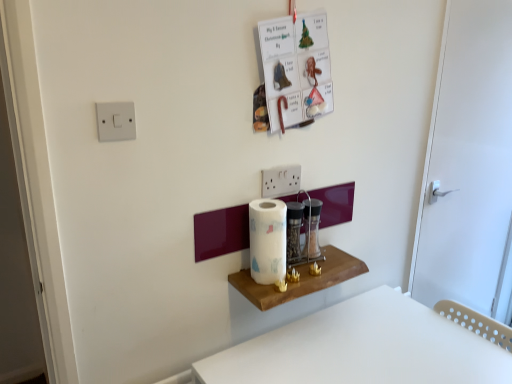
At what (x,y) coordinates should I click in order to perform the action: click on white glossy paper towel at center. Please return your answer as a coordinate pair (x, y). The height and width of the screenshot is (384, 512). Looking at the image, I should click on (267, 240).

In order to click on wooden shelf at center in this screenshot , I will do `click(300, 279)`.

This screenshot has width=512, height=384. In order to click on white glossy paper towel at center in this screenshot , I will do `click(267, 240)`.

Is white plastic table at lower right located outside white plastic light switch at upper left?

Indeed, white plastic table at lower right is completely outside white plastic light switch at upper left.

From the image's perspective, is white plastic table at lower right above or below white plastic light switch at upper left?

Clearly, from the image's perspective, white plastic table at lower right is below white plastic light switch at upper left.

Where is `light switch behind the white plastic table at lower right`? This screenshot has height=384, width=512. light switch behind the white plastic table at lower right is located at coordinates (116, 121).

From the picture: Considering the sizes of objects white plastic table at lower right and white plastic light switch at upper left in the image provided, who is smaller, white plastic table at lower right or white plastic light switch at upper left?

Smaller between the two is white plastic light switch at upper left.

Does white plastic table at lower right appear on the left side of white matte door at right?

Yes.

Is white plastic table at lower right not within white matte door at right?

white plastic table at lower right is positioned outside white matte door at right.

Is white matte door at right at the back of white plastic table at lower right?

No, white matte door at right is not at the back of white plastic table at lower right.

How different are the orientations of white matte door at right and white glossy paper towel at center in degrees?

They differ by 0.00121 degrees in their facing directions.

From a real-world perspective, is white matte door at right located beneath white glossy paper towel at center?

Incorrect, from a real-world perspective, white matte door at right is higher than white glossy paper towel at center.

Is white matte door at right closer to camera compared to white glossy paper towel at center?

No, white matte door at right is further to the viewer.

Does white matte door at right appear on the right side of white glossy paper towel at center?

Indeed, white matte door at right is positioned on the right side of white glossy paper towel at center.

Looking at this image, from a real-world perspective, between wooden shelf at center and white glossy paper towel at center, who is vertically lower?

wooden shelf at center, from a real-world perspective.

Locate an element on the screen. shelf located behind the white glossy paper towel at center is located at coordinates (300, 279).

Is wooden shelf at center positioned with its back to white glossy paper towel at center?

No, white glossy paper towel at center is not at the back of wooden shelf at center.

Is wooden shelf at center shorter than white glossy paper towel at center?

Indeed, wooden shelf at center has a lesser height compared to white glossy paper towel at center.

Considering the sizes of objects wooden shelf at center and white matte door at right in the image provided, who is smaller, wooden shelf at center or white matte door at right?

wooden shelf at center.

Which is closer, (326, 262) or (488, 240)?

Point (326, 262) is positioned closer to the camera compared to point (488, 240).

Is wooden shelf at center facing towards white matte door at right?

No, wooden shelf at center does not turn towards white matte door at right.

Is wooden shelf at center located outside white matte door at right?

Yes.

Could wooden shelf at center be considered to be inside white glossy paper towel at center?

No, wooden shelf at center is not inside white glossy paper towel at center.

Based on the photo, is white glossy paper towel at center facing towards wooden shelf at center?

No, white glossy paper towel at center is not facing towards wooden shelf at center.

From a real-world perspective, is white glossy paper towel at center physically below wooden shelf at center?

Incorrect, from a real-world perspective, white glossy paper towel at center is higher than wooden shelf at center.

Which object is wider, wooden shelf at center or white plastic light switch at upper left?

With larger width is wooden shelf at center.

Is wooden shelf at center at the left side of white plastic light switch at upper left?

Incorrect, wooden shelf at center is not on the left side of white plastic light switch at upper left.

Find the location of a particular element. light switch that appears in front of the wooden shelf at center is located at coordinates (116, 121).

Is wooden shelf at center in front of white plastic light switch at upper left?

No.

The width and height of the screenshot is (512, 384). I want to click on furniture below the white plastic light switch at upper left (from a real-world perspective), so click(362, 348).

Find the location of a particular element. The image size is (512, 384). furniture below the white matte door at right (from the image's perspective) is located at coordinates (362, 348).

Considering their positions, is white matte door at right positioned further to white glossy paper towel at center than white plastic light switch at upper left?

white matte door at right is positioned further to the anchor white glossy paper towel at center.

Looking at the image, which one is located closer to white matte door at right, wooden shelf at center or white glossy paper towel at center?

wooden shelf at center lies closer to white matte door at right than the other object.

Which object lies further to the anchor point white plastic table at lower right, white matte door at right or wooden shelf at center?

white matte door at right.

Considering their positions, is white plastic light switch at upper left positioned closer to white matte door at right than wooden shelf at center?

Based on the image, wooden shelf at center appears to be nearer to white matte door at right.

Estimate the real-world distances between objects in this image. Which object is further from white matte door at right, white glossy paper towel at center or white plastic light switch at upper left?

The object further to white matte door at right is white plastic light switch at upper left.

Considering their positions, is white glossy paper towel at center positioned further to wooden shelf at center than white matte door at right?

Among the two, white matte door at right is located further to wooden shelf at center.

Considering their positions, is white glossy paper towel at center positioned further to white plastic table at lower right than white plastic light switch at upper left?

white plastic light switch at upper left is further to white plastic table at lower right.

Considering their positions, is wooden shelf at center positioned closer to white plastic light switch at upper left than white glossy paper towel at center?

white glossy paper towel at center.

The width and height of the screenshot is (512, 384). I want to click on shelf between white plastic light switch at upper left and white matte door at right in the horizontal direction, so pos(300,279).

The width and height of the screenshot is (512, 384). In order to click on shelf located between white glossy paper towel at center and white matte door at right in the left-right direction in this screenshot , I will do [300, 279].

Find the location of a particular element. paper towel situated between white plastic light switch at upper left and white plastic table at lower right from left to right is located at coordinates (267, 240).

Where is `furniture located between white plastic light switch at upper left and white matte door at right in the left-right direction`? Image resolution: width=512 pixels, height=384 pixels. furniture located between white plastic light switch at upper left and white matte door at right in the left-right direction is located at coordinates (362, 348).